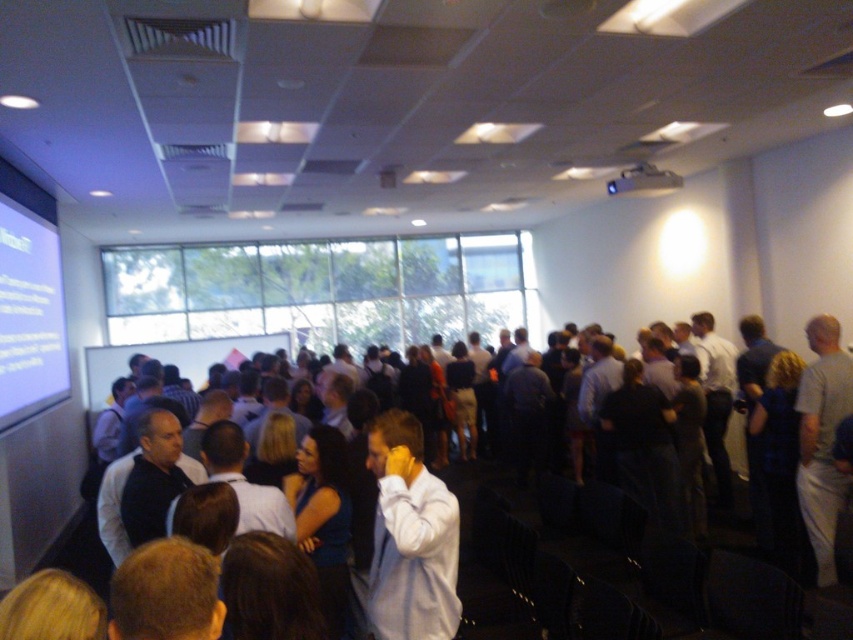
Find the location of a particular element. white glossy projection screen at upper left is located at coordinates (28, 314).

Who is lower down, white matte shirt at center or white glossy projection screen at upper left?

Positioned lower is white matte shirt at center.

Is point (419, 449) closer to camera compared to point (3, 320)?

Yes, it is in front of point (3, 320).

Where is `white matte shirt at center`? white matte shirt at center is located at coordinates (410, 538).

Does white matte shirt at center have a lesser height compared to black plastic projector at upper center?

In fact, white matte shirt at center may be taller than black plastic projector at upper center.

Measure the distance between point (372, 561) and camera.

The distance of point (372, 561) from camera is 8.24 feet.

Is point (428, 637) positioned in front of point (614, 195)?

Yes.

Image resolution: width=853 pixels, height=640 pixels. Identify the location of white matte shirt at center. (410, 538).